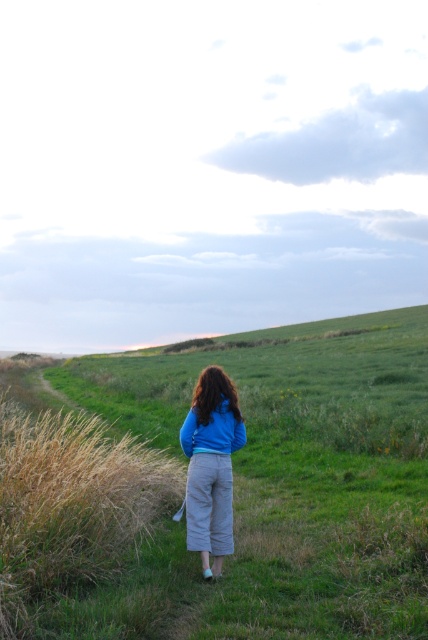
The image size is (428, 640). In order to click on blue cotton jacket at center in this screenshot , I will do pyautogui.click(x=211, y=467).

Does blue cotton jacket at center have a lesser height compared to blue fleece sweatshirt at center?

Incorrect, blue cotton jacket at center's height does not fall short of blue fleece sweatshirt at center's.

Who is more distant from viewer, (x=202, y=465) or (x=195, y=452)?

The point (x=195, y=452) is behind.

Locate an element on the screen. blue cotton jacket at center is located at coordinates (211, 467).